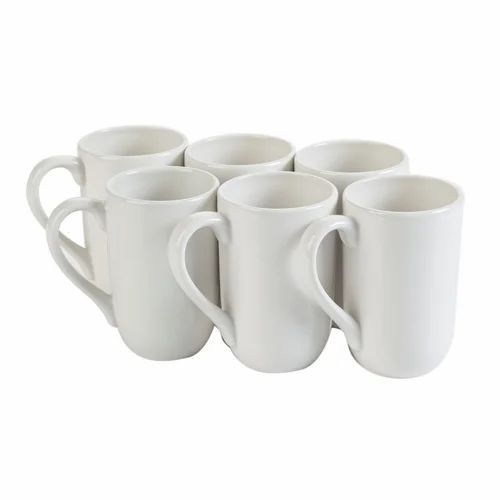
Where is `coffee mugs`? coffee mugs is located at coordinates (82, 170), (109, 243), (225, 162), (262, 257), (345, 254), (350, 179).